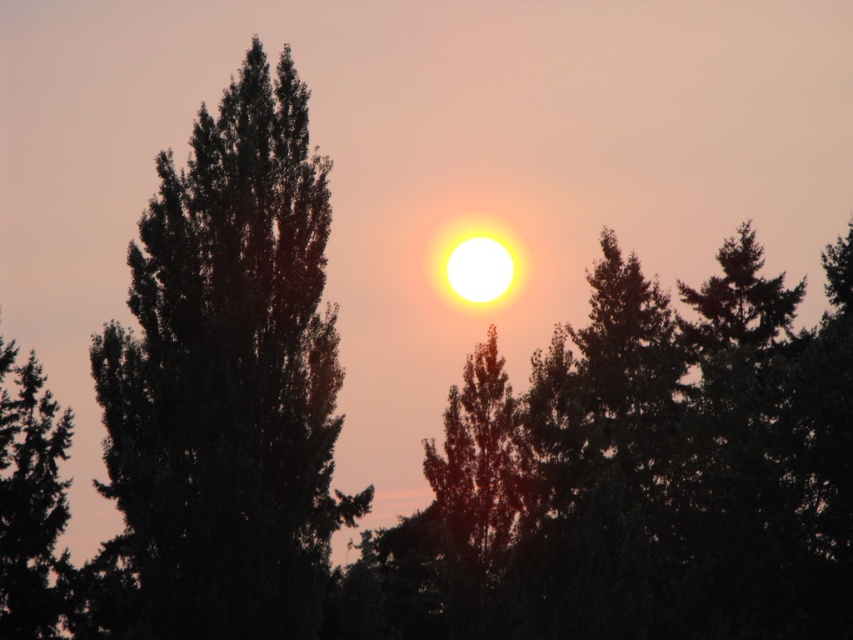
Question: Is dark green leafy tree at left above dark green textured tree at left?

Choices:
 (A) yes
 (B) no

Answer: (B)

Question: Is dark green leafy tree at left bigger than dark green textured tree at left?

Choices:
 (A) no
 (B) yes

Answer: (B)

Question: Does dark green leafy tree at left have a lesser width compared to dark green textured tree at left?

Choices:
 (A) no
 (B) yes

Answer: (B)

Question: Which of the following is the closest to the observer?

Choices:
 (A) dark green textured tree at left
 (B) dark green leafy tree at left

Answer: (B)